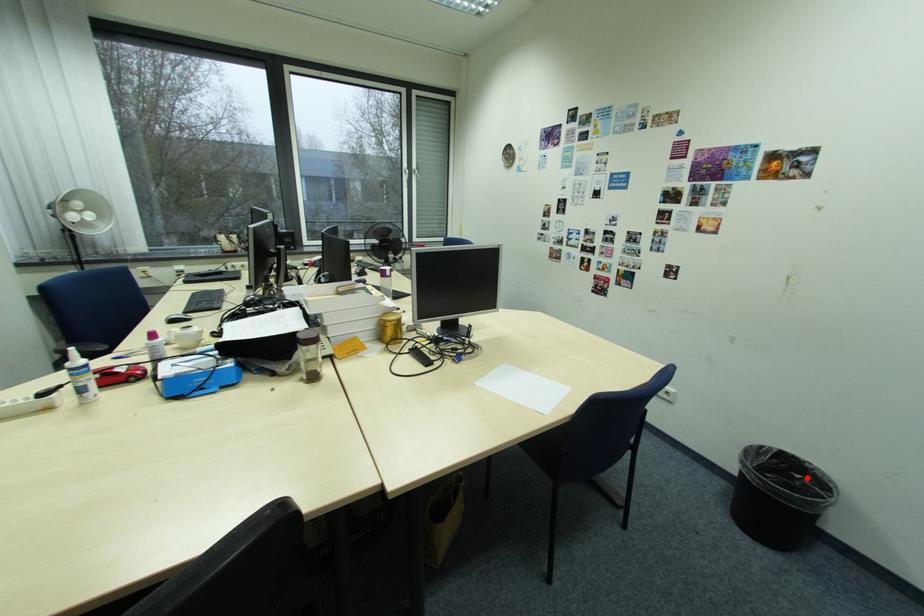
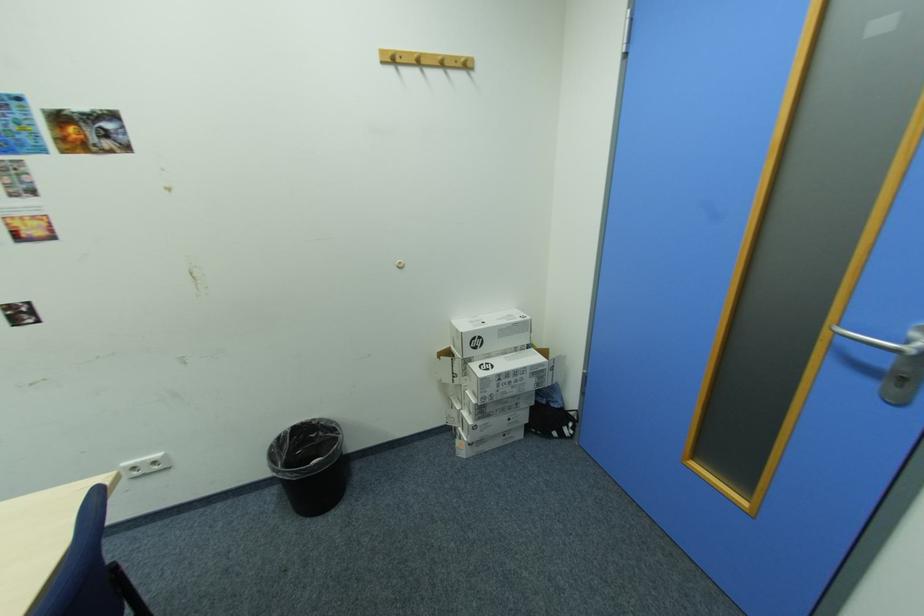
Question: I am providing you with two images of the same scene from different viewpoints. In image1, a red point is highlighted. Considering the same 3D point in image2, which of the following is correct?

Choices:
 (A) It is closer
 (B) It is farther

Answer: (B)